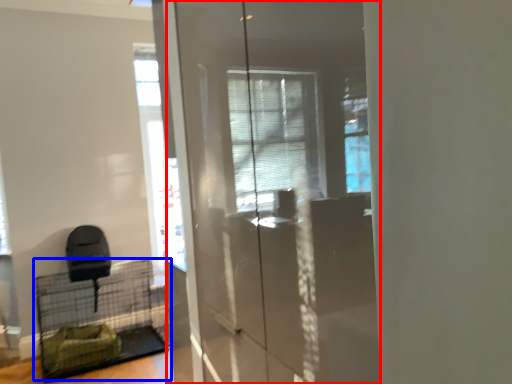
Question: Which point is closer to the camera, screen door (highlighted by a red box) or bird cage (highlighted by a blue box)?

Choices:
 (A) screen door
 (B) bird cage

Answer: (A)